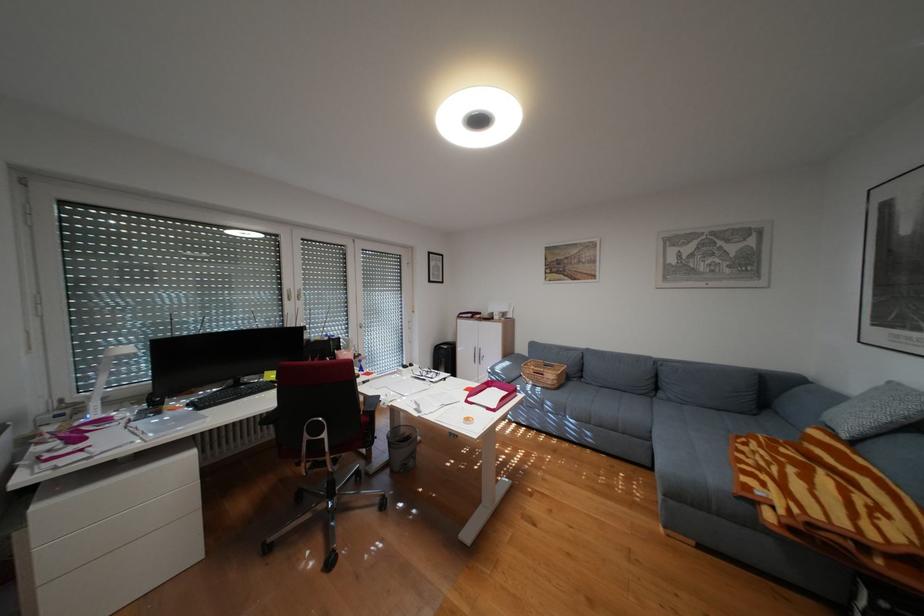
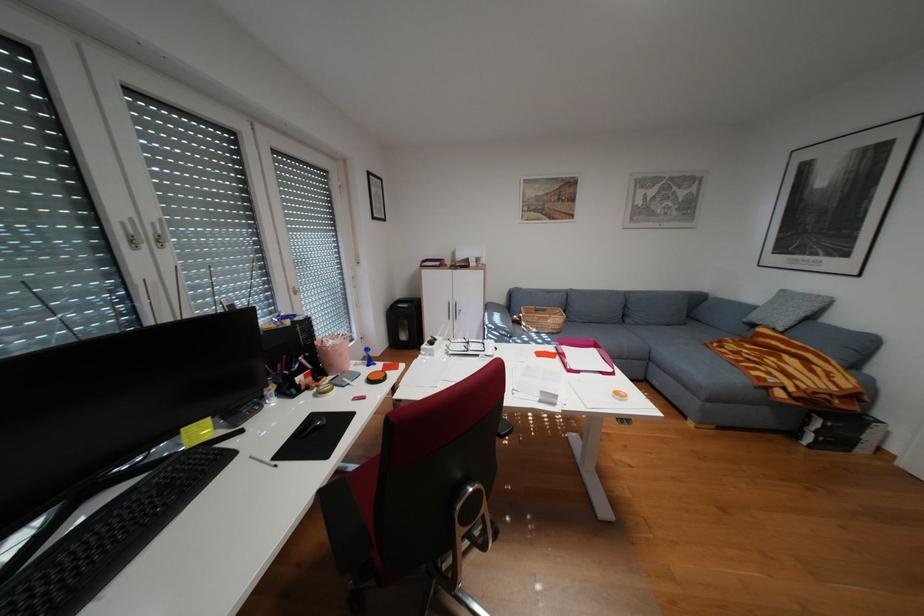
In the second image, find the point that corresponds to point (421, 367) in the first image.

(448, 342)